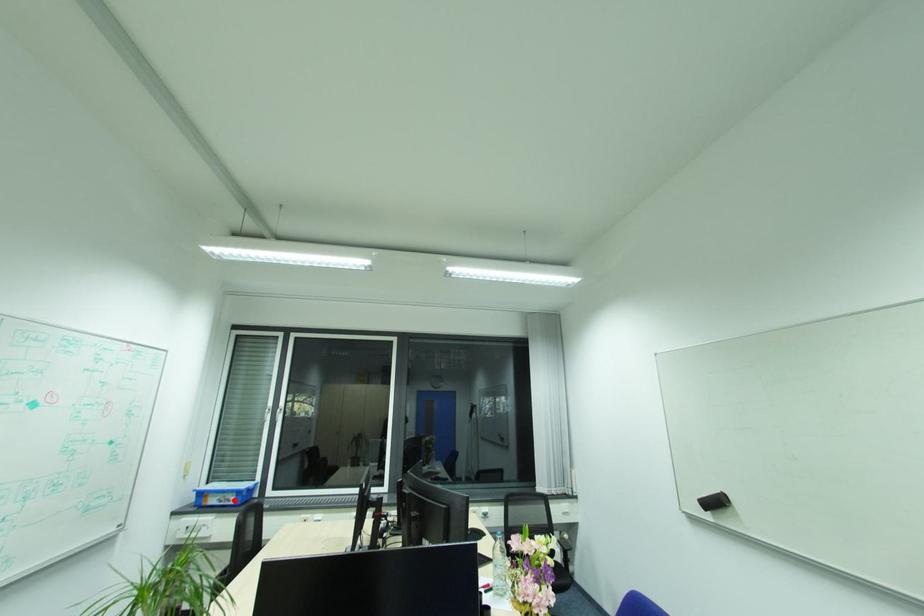
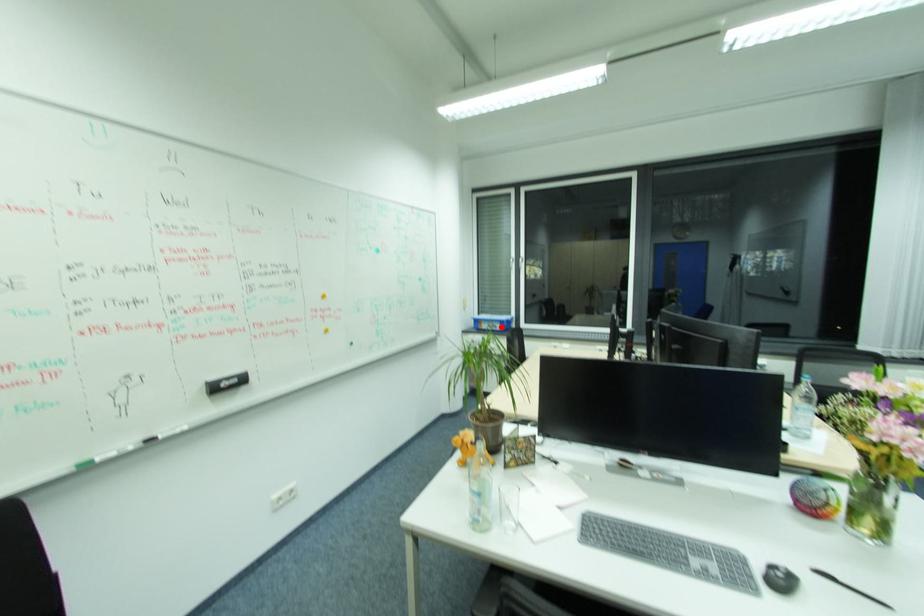
I am providing you with two images of the same scene from different viewpoints. A red point is marked on the first image and another point is marked on the second image. Is the marked point in image1 the same physical position as the marked point in image2?

Yes